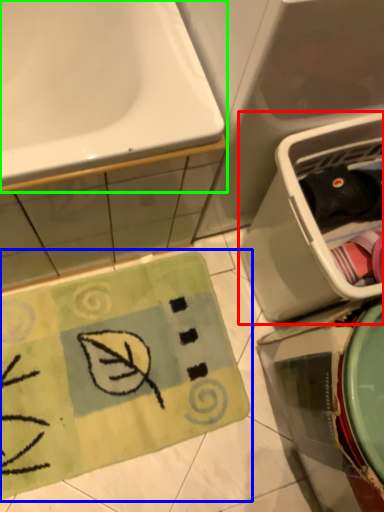
Question: Considering the real-world distances, which object is farthest from dish washer (highlighted by a red box)? doormat (highlighted by a blue box) or sink (highlighted by a green box)?

Choices:
 (A) doormat
 (B) sink

Answer: (A)